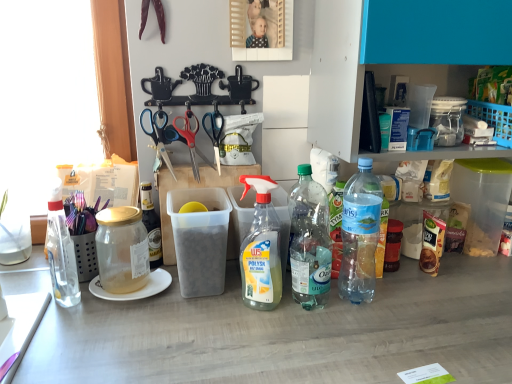
Question: Is clear glass bottle at left, marked as the first bottle in a left-to-right arrangement, completely or partially inside transparent glass jar at left, which ranks as the fourth bottle in right-to-left order?

Choices:
 (A) yes
 (B) no

Answer: (B)

Question: Is transparent glass jar at left, which ranks as the fourth bottle in right-to-left order, wider than clear glass bottle at left, marked as the first bottle in a left-to-right arrangement?

Choices:
 (A) yes
 (B) no

Answer: (A)

Question: Can you see transparent glass jar at left, marked as the second bottle in a left-to-right arrangement, touching clear glass bottle at left, the fifth bottle in the right-to-left sequence?

Choices:
 (A) no
 (B) yes

Answer: (A)

Question: Could you tell me if transparent glass jar at left, marked as the second bottle in a left-to-right arrangement, is turned towards clear glass bottle at left, marked as the first bottle in a left-to-right arrangement?

Choices:
 (A) yes
 (B) no

Answer: (B)

Question: Does transparent glass jar at left, which ranks as the fourth bottle in right-to-left order, come in front of clear glass bottle at left, marked as the first bottle in a left-to-right arrangement?

Choices:
 (A) yes
 (B) no

Answer: (B)

Question: From the image's perspective, is transparent glass jar at left, which ranks as the fourth bottle in right-to-left order, on clear glass bottle at left, the fifth bottle in the right-to-left sequence?

Choices:
 (A) no
 (B) yes

Answer: (A)

Question: Is red plastic scissors at center, which is the 2th scissors from right to left, bigger than clear plastic bottle at center-right, which is counted as the 4th bottle, starting from the left?

Choices:
 (A) yes
 (B) no

Answer: (B)

Question: Is clear plastic bottle at center-right, placed as the 2th bottle when sorted from right to left, at the back of red plastic scissors at center, which is the 2th scissors from right to left?

Choices:
 (A) yes
 (B) no

Answer: (B)

Question: Considering the relative sizes of red plastic scissors at center, which is the 2th scissors from right to left, and clear plastic bottle at center-right, which is counted as the 4th bottle, starting from the left, in the image provided, is red plastic scissors at center, which is the 2th scissors from right to left, taller than clear plastic bottle at center-right, which is counted as the 4th bottle, starting from the left,?

Choices:
 (A) yes
 (B) no

Answer: (B)

Question: Are red plastic scissors at center, which is the second scissors from left to right, and clear plastic bottle at center-right, which is counted as the 4th bottle, starting from the left, beside each other?

Choices:
 (A) no
 (B) yes

Answer: (A)

Question: Can you confirm if red plastic scissors at center, which is the 2th scissors from right to left, is positioned to the right of clear plastic bottle at center-right, placed as the 2th bottle when sorted from right to left?

Choices:
 (A) yes
 (B) no

Answer: (B)

Question: Considering the relative sizes of red plastic scissors at center, which is the 2th scissors from right to left, and clear plastic bottle at center-right, placed as the 2th bottle when sorted from right to left, in the image provided, is red plastic scissors at center, which is the 2th scissors from right to left, shorter than clear plastic bottle at center-right, placed as the 2th bottle when sorted from right to left,?

Choices:
 (A) no
 (B) yes

Answer: (B)

Question: Is the depth of clear plastic bottle at center, which appears as the 3th bottle when viewed from the right, greater than that of red plastic scissors at center, which is the second scissors from left to right?

Choices:
 (A) yes
 (B) no

Answer: (B)